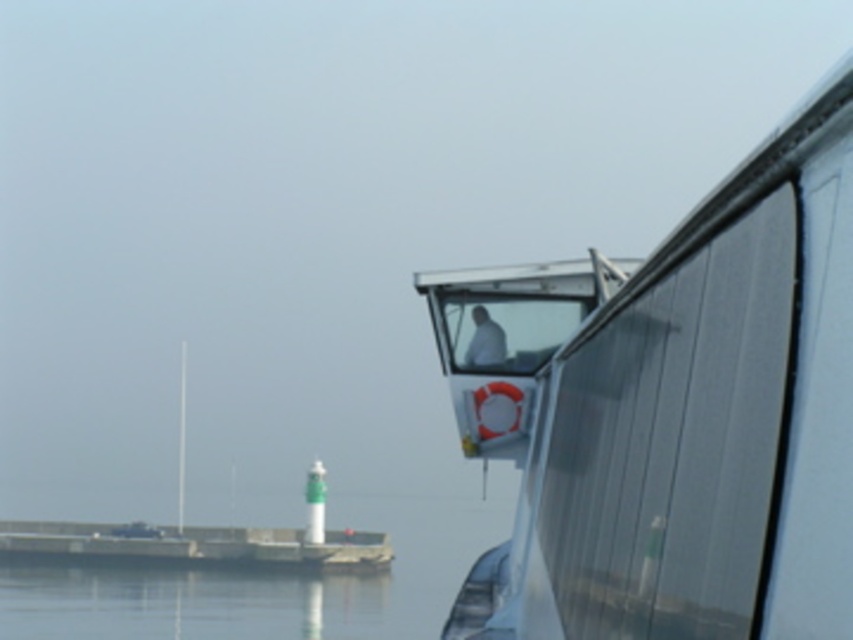
You are a dock worker who needs to park the white glossy boat at upper center on the concrete dock at lower left. Based on their sizes, will the boat fit on the dock?

The white glossy boat at upper center has a width less than the concrete dock at lower left, so the boat will fit on the dock.

Consider the image. You are a sailor who needs to dock your boat. You see a white glossy boat at upper center and a concrete dock at lower left. Which one is located higher in the image?

The white glossy boat at upper center is located higher in the image than the concrete dock at lower left.